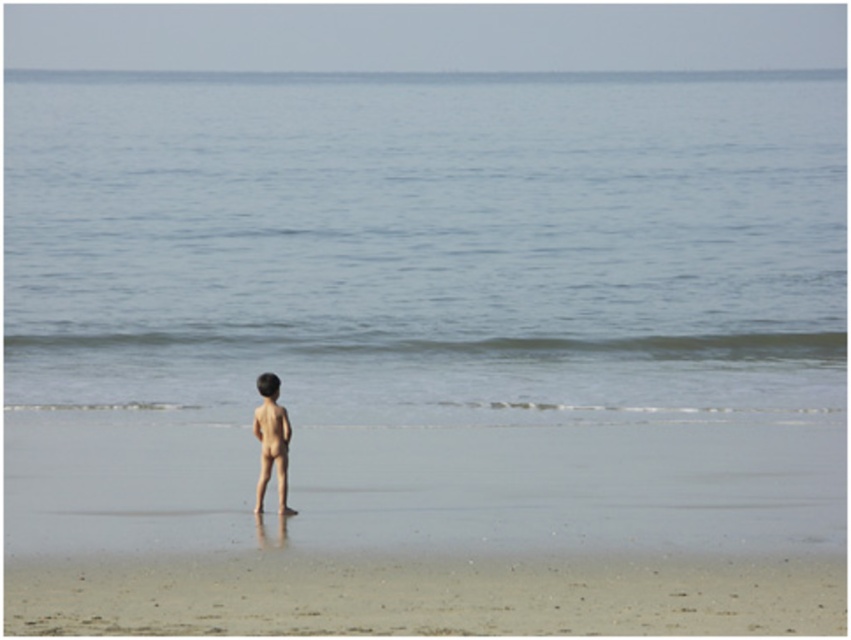
Question: Which object is closer to the camera taking this photo?

Choices:
 (A) smooth sand at center
 (B) smooth skin boy at center
 (C) blue water at center

Answer: (A)

Question: Does blue water at center come in front of smooth sand at center?

Choices:
 (A) yes
 (B) no

Answer: (B)

Question: Can you confirm if blue water at center is positioned below smooth skin boy at center?

Choices:
 (A) no
 (B) yes

Answer: (A)

Question: Which point is closer to the camera?

Choices:
 (A) (229, 280)
 (B) (544, 433)

Answer: (B)

Question: Which point appears closest to the camera in this image?

Choices:
 (A) (364, 579)
 (B) (444, 289)

Answer: (A)

Question: Can you confirm if blue water at center is smaller than smooth skin boy at center?

Choices:
 (A) no
 (B) yes

Answer: (A)